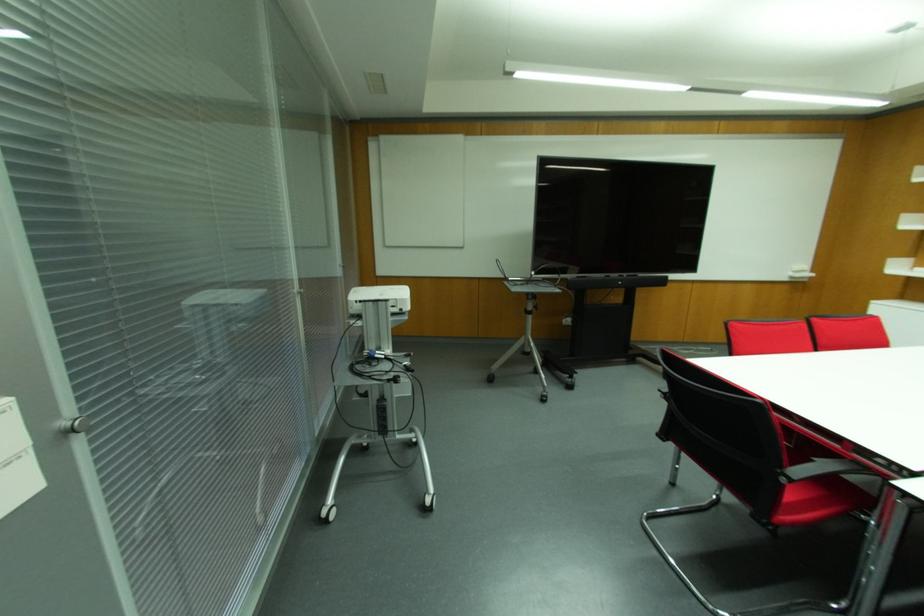
I want to click on closed silver laptop, so click(527, 284).